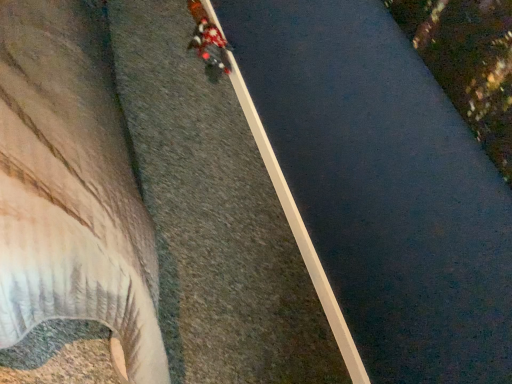
Question: From the image's perspective, is red fabric jacket at upper center over smooth concrete waterway at center?

Choices:
 (A) yes
 (B) no

Answer: (A)

Question: Considering the relative sizes of red fabric jacket at upper center and smooth concrete waterway at center in the image provided, is red fabric jacket at upper center thinner than smooth concrete waterway at center?

Choices:
 (A) no
 (B) yes

Answer: (A)

Question: Would you say smooth concrete waterway at center is part of red fabric jacket at upper center's contents?

Choices:
 (A) no
 (B) yes

Answer: (A)

Question: Considering the relative sizes of red fabric jacket at upper center and smooth concrete waterway at center in the image provided, is red fabric jacket at upper center wider than smooth concrete waterway at center?

Choices:
 (A) no
 (B) yes

Answer: (B)

Question: Is red fabric jacket at upper center at the right side of smooth concrete waterway at center?

Choices:
 (A) yes
 (B) no

Answer: (B)

Question: Is red fabric jacket at upper center further to camera compared to smooth concrete waterway at center?

Choices:
 (A) yes
 (B) no

Answer: (A)

Question: Would you say smooth concrete waterway at center is outside red fabric jacket at upper center?

Choices:
 (A) yes
 (B) no

Answer: (A)

Question: Is smooth concrete waterway at center wider than red fabric jacket at upper center?

Choices:
 (A) yes
 (B) no

Answer: (B)

Question: Can you confirm if smooth concrete waterway at center is bigger than red fabric jacket at upper center?

Choices:
 (A) no
 (B) yes

Answer: (A)

Question: Is the position of smooth concrete waterway at center less distant than that of red fabric jacket at upper center?

Choices:
 (A) yes
 (B) no

Answer: (A)

Question: Is smooth concrete waterway at center to the right of red fabric jacket at upper center from the viewer's perspective?

Choices:
 (A) no
 (B) yes

Answer: (B)

Question: Considering the relative positions of smooth concrete waterway at center and red fabric jacket at upper center in the image provided, is smooth concrete waterway at center to the left of red fabric jacket at upper center from the viewer's perspective?

Choices:
 (A) no
 (B) yes

Answer: (A)

Question: Is point (194, 18) closer or farther from the camera than point (457, 160)?

Choices:
 (A) closer
 (B) farther

Answer: (B)